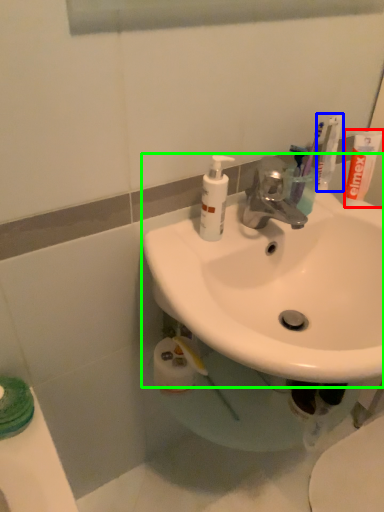
Question: Which object is the closest to the toothpaste (highlighted by a red box)? Choose among these: toothbrush (highlighted by a blue box) or sink (highlighted by a green box).

Choices:
 (A) toothbrush
 (B) sink

Answer: (A)